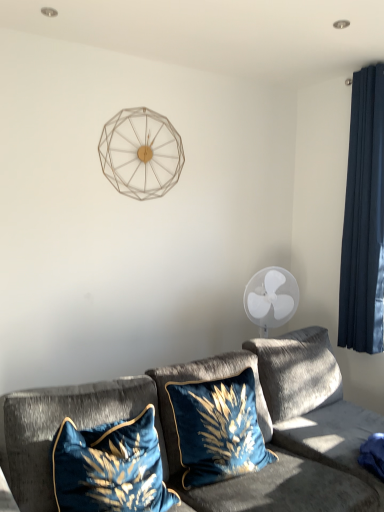
Question: Should I look upward or downward to see dark blue velvet curtain at right?

Choices:
 (A) down
 (B) up

Answer: (B)

Question: Is velvet blue pillow at center, which ranks as the 2th pillow in left-to-right order, shorter than velvet gray couch at lower center?

Choices:
 (A) yes
 (B) no

Answer: (A)

Question: From the image's perspective, would you say velvet blue pillow at center, which ranks as the 2th pillow in left-to-right order, is shown under velvet gray couch at lower center?

Choices:
 (A) no
 (B) yes

Answer: (A)

Question: Is the surface of velvet blue pillow at center, which is the 1th pillow from right to left, in direct contact with velvet gray couch at lower center?

Choices:
 (A) no
 (B) yes

Answer: (A)

Question: Can you confirm if velvet blue pillow at center, which ranks as the 2th pillow in left-to-right order, is bigger than velvet gray couch at lower center?

Choices:
 (A) no
 (B) yes

Answer: (A)

Question: Considering the relative sizes of velvet blue pillow at center, which ranks as the 2th pillow in left-to-right order, and velvet gray couch at lower center in the image provided, is velvet blue pillow at center, which ranks as the 2th pillow in left-to-right order, smaller than velvet gray couch at lower center?

Choices:
 (A) no
 (B) yes

Answer: (B)

Question: Is velvet blue pillow at center, which is the 1th pillow from right to left, completely or partially outside of velvet gray couch at lower center?

Choices:
 (A) no
 (B) yes

Answer: (A)

Question: Considering the relative positions of metallic wireframe clock at upper center and dark blue velvet curtain at right in the image provided, is metallic wireframe clock at upper center to the left of dark blue velvet curtain at right from the viewer's perspective?

Choices:
 (A) yes
 (B) no

Answer: (A)

Question: Does metallic wireframe clock at upper center have a smaller size compared to dark blue velvet curtain at right?

Choices:
 (A) yes
 (B) no

Answer: (A)

Question: From a real-world perspective, is metallic wireframe clock at upper center on top of dark blue velvet curtain at right?

Choices:
 (A) yes
 (B) no

Answer: (A)

Question: Is metallic wireframe clock at upper center bigger than dark blue velvet curtain at right?

Choices:
 (A) yes
 (B) no

Answer: (B)

Question: Is dark blue velvet curtain at right at the back of metallic wireframe clock at upper center?

Choices:
 (A) no
 (B) yes

Answer: (A)

Question: From the image's perspective, is metallic wireframe clock at upper center over dark blue velvet curtain at right?

Choices:
 (A) no
 (B) yes

Answer: (B)

Question: Is metallic wireframe clock at upper center oriented towards velvet gray couch at lower center?

Choices:
 (A) no
 (B) yes

Answer: (A)